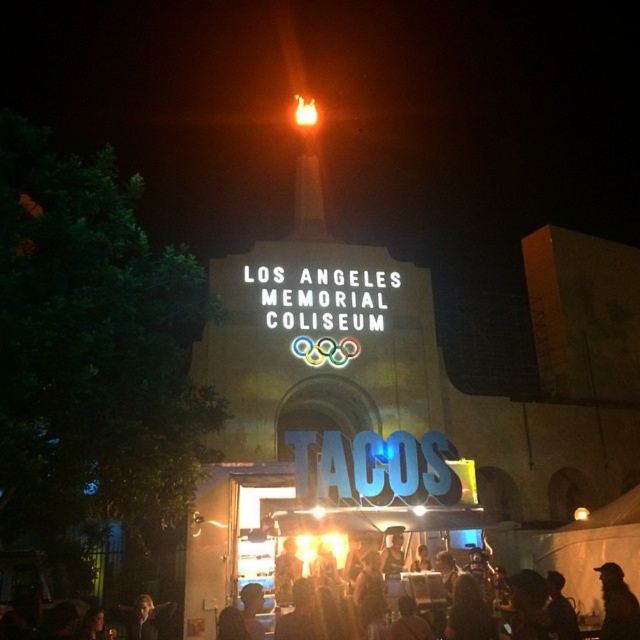
You are a food truck owner who just arrived at the Los Angeles Memorial Coliseum for an event. You notice the black matte crowd at lower center and the silhouette fabric at lower right in the parking lot. Which object should you position your truck closer to if you want to attract more customers?

The black matte crowd at lower center has a larger size compared to the silhouette fabric at lower right, so positioning the truck closer to the black matte crowd at lower center would attract more customers due to its larger crowd size.

You are a photographer standing at the front of the Los Angeles Memorial Coliseum at night. You want to capture a photo that includes both the black matte crowd at lower center and the silhouette fabric at lower right. Based on their positions, which object is closer to the camera?

The black matte crowd at lower center is closer to the camera because it is positioned at lower center, while the silhouette fabric at lower right is located further away at lower right.